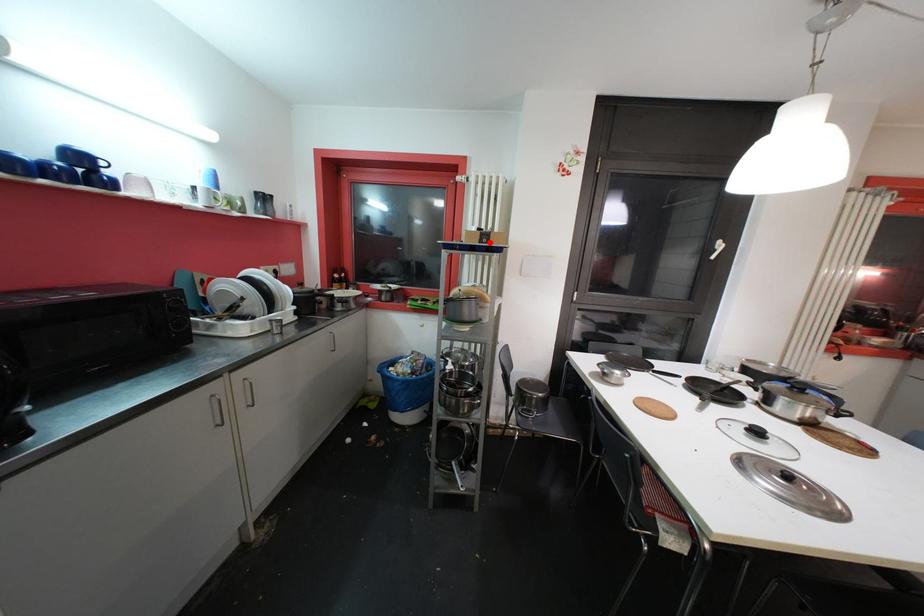
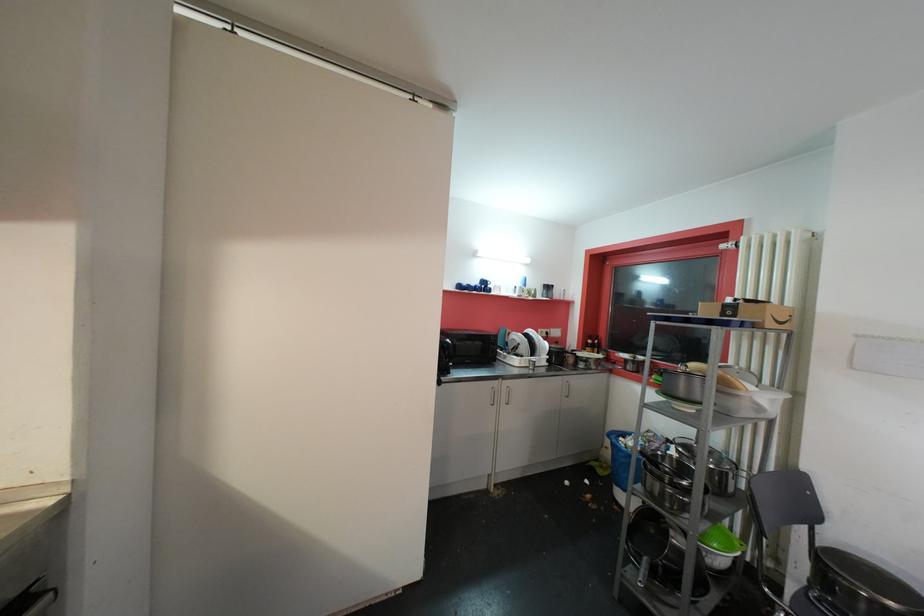
Where in the second image is the point corresponding to the highlighted location from the first image?

(734, 315)